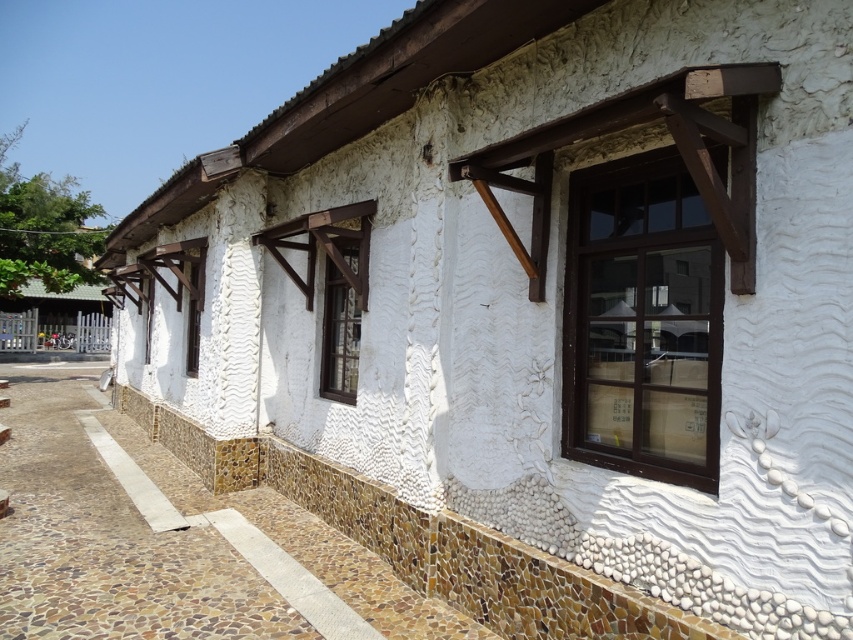
Question: Is matte glass window at center positioned at the back of white textured window at center?

Choices:
 (A) yes
 (B) no

Answer: (B)

Question: Which point is closer to the camera taking this photo?

Choices:
 (A) (608, 269)
 (B) (354, 262)
 (C) (152, 300)

Answer: (A)

Question: Can you confirm if matte glass window at center is wider than matte white window at center?

Choices:
 (A) yes
 (B) no

Answer: (A)

Question: Does matte glass window at center have a larger size compared to matte white window at center?

Choices:
 (A) yes
 (B) no

Answer: (A)

Question: Which object is positioned closest to the matte glass window at center?

Choices:
 (A) white textured window at center
 (B) brown wooden window at center
 (C) matte white window at center

Answer: (B)

Question: Estimate the real-world distances between objects in this image. Which object is farther from the matte glass window at center?

Choices:
 (A) white textured window at center
 (B) brown wooden window at center

Answer: (A)